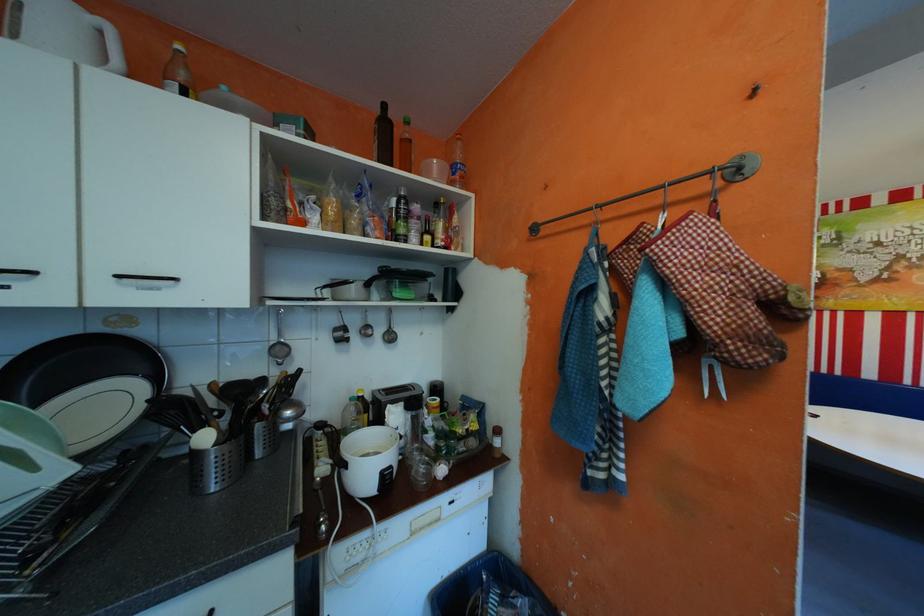
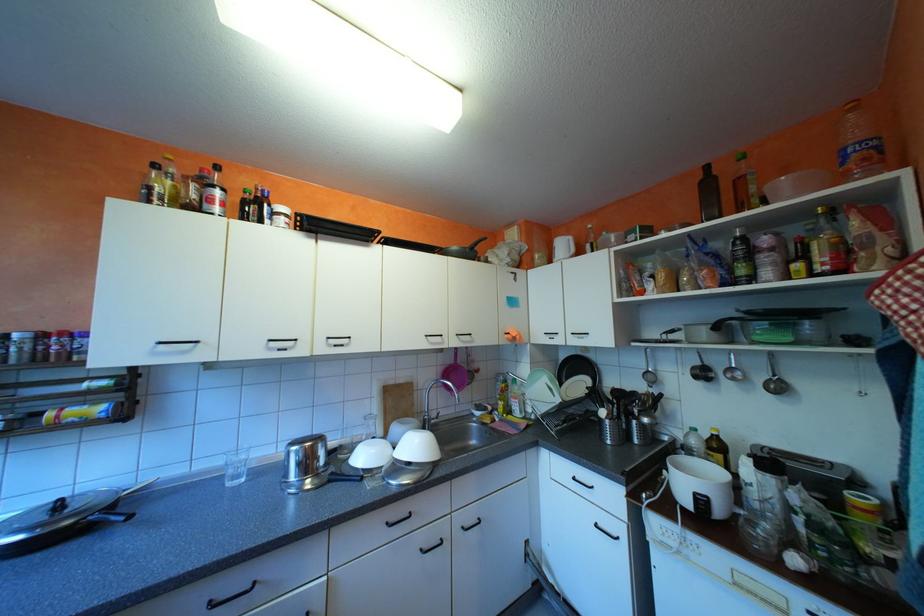
Question: The camera is either moving clockwise (left) or counter-clockwise (right) around the object. The first image is from the beginning of the video and the second image is from the end. Is the camera moving left or right when shooting the video?

Choices:
 (A) Left
 (B) Right

Answer: (B)